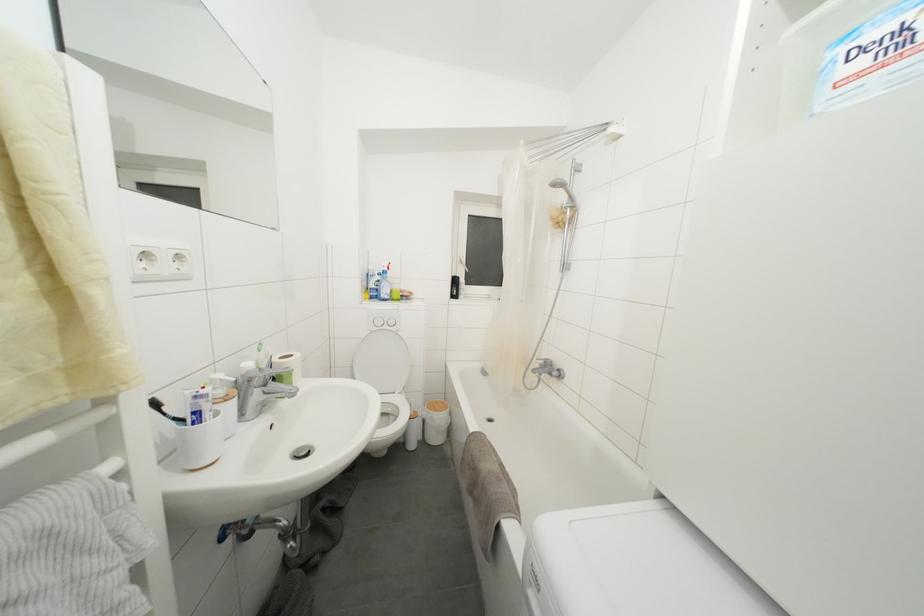
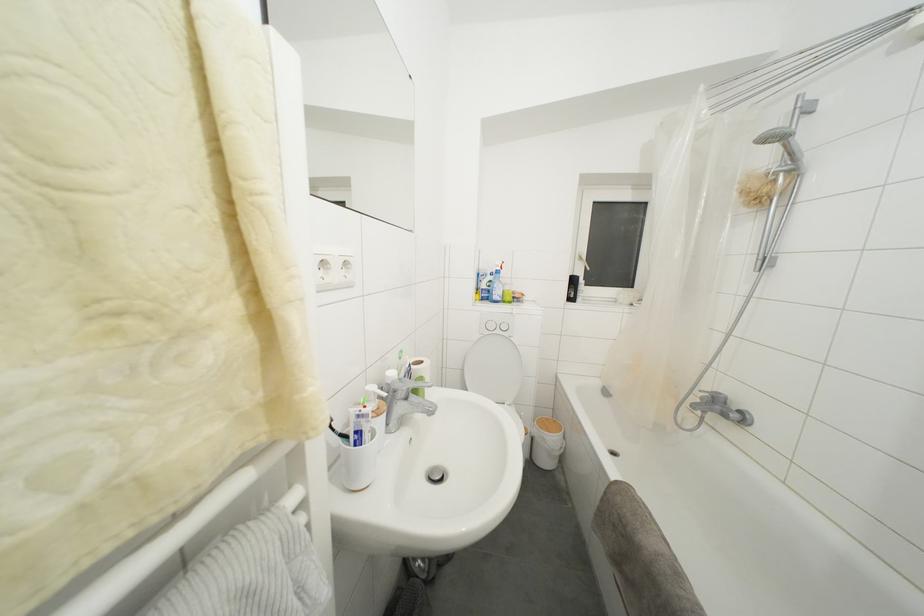
Locate, in the second image, the point that corresponds to pixel 399 338 in the first image.

(513, 344)